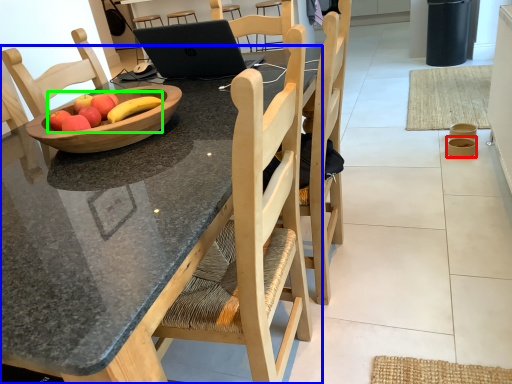
Question: Which is farther away from bowl (highlighted by a red box)? desk (highlighted by a blue box) or fruit (highlighted by a green box)?

Choices:
 (A) desk
 (B) fruit

Answer: (A)